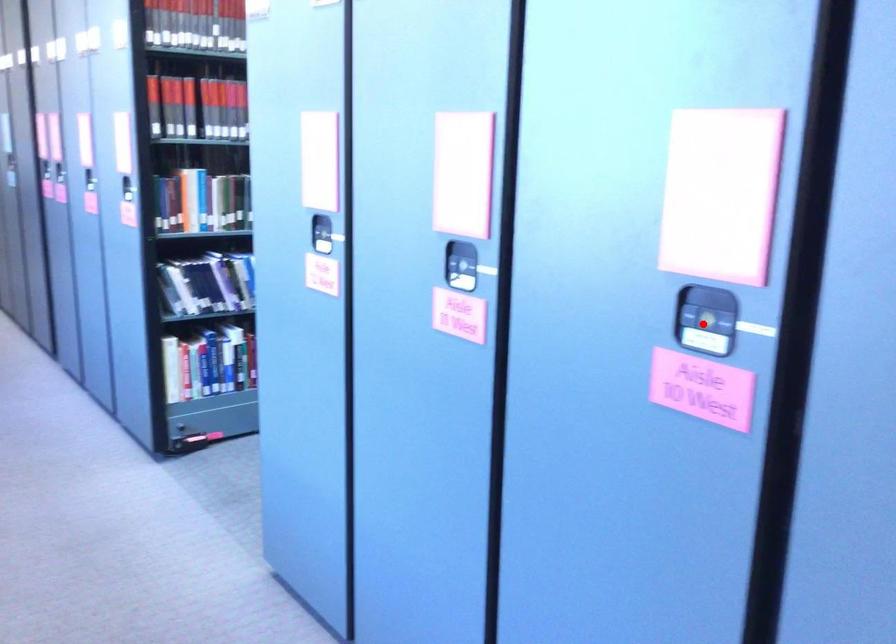
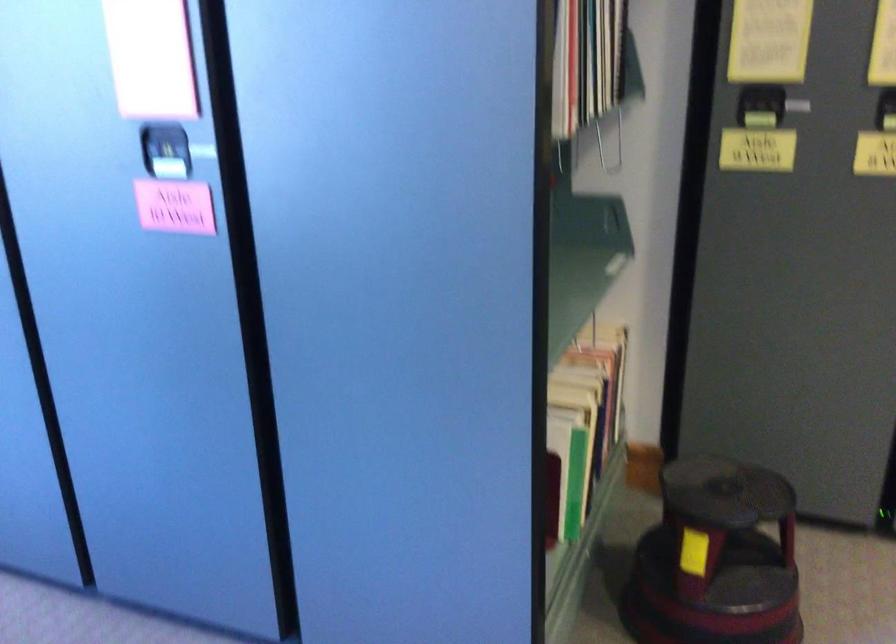
Locate, in the second image, the point that corresponds to the highlighted location in the first image.

(165, 151)